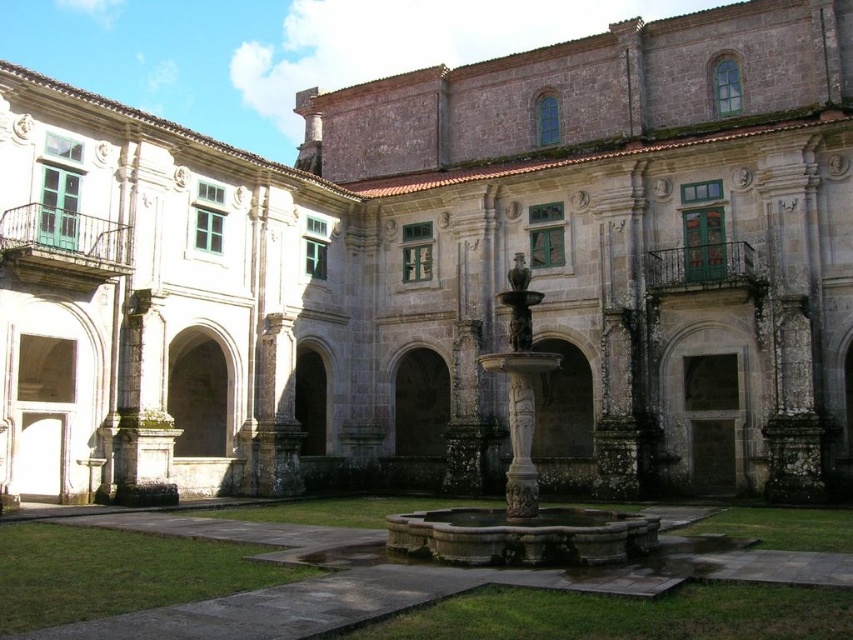
Question: Can you confirm if stone fountain at center is positioned to the right of carved stone fountain at center?

Choices:
 (A) no
 (B) yes

Answer: (A)

Question: Which of the following is the farthest from the observer?

Choices:
 (A) (529, 538)
 (B) (10, 529)

Answer: (B)

Question: Does stone fountain at center have a greater width compared to carved stone fountain at center?

Choices:
 (A) yes
 (B) no

Answer: (A)

Question: Observing the image, what is the correct spatial positioning of stone fountain at center in reference to carved stone fountain at center?

Choices:
 (A) below
 (B) above

Answer: (A)

Question: Among these objects, which one is farthest from the camera?

Choices:
 (A) carved stone fountain at center
 (B) stone fountain at center

Answer: (A)